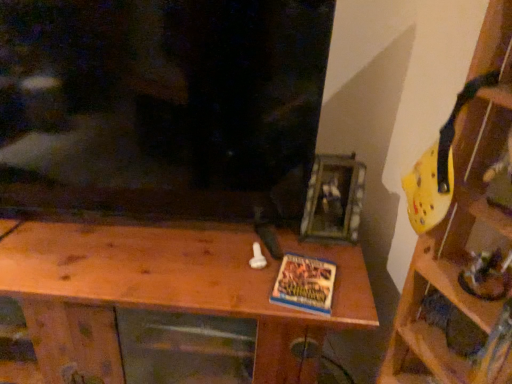
Question: Can you confirm if yellow plastic helmet at upper right, arranged as the second shelf when viewed from the left, is positioned to the right of blue matte book at center?

Choices:
 (A) yes
 (B) no

Answer: (A)

Question: Is yellow plastic helmet at upper right, the first shelf from the right, bigger than blue matte book at center?

Choices:
 (A) no
 (B) yes

Answer: (B)

Question: Can you confirm if yellow plastic helmet at upper right, arranged as the second shelf when viewed from the left, is taller than blue matte book at center?

Choices:
 (A) no
 (B) yes

Answer: (B)

Question: Is blue matte book at center at the back of yellow plastic helmet at upper right, arranged as the second shelf when viewed from the left?

Choices:
 (A) yes
 (B) no

Answer: (B)

Question: From the image's perspective, is yellow plastic helmet at upper right, arranged as the second shelf when viewed from the left, located beneath blue matte book at center?

Choices:
 (A) no
 (B) yes

Answer: (A)

Question: Considering the positions of point [423, 321] and point [89, 365], is point [423, 321] closer or farther from the camera than point [89, 365]?

Choices:
 (A) farther
 (B) closer

Answer: (B)

Question: In the image, is yellow plastic helmet at upper right, arranged as the second shelf when viewed from the left, positioned in front of or behind wooden at center, positioned as the 1th shelf in left-to-right order?

Choices:
 (A) behind
 (B) front

Answer: (B)

Question: In terms of width, does yellow plastic helmet at upper right, arranged as the second shelf when viewed from the left, look wider or thinner when compared to wooden at center, which is the second shelf in right-to-left order?

Choices:
 (A) thin
 (B) wide

Answer: (A)

Question: Considering the positions of yellow plastic helmet at upper right, arranged as the second shelf when viewed from the left, and wooden at center, positioned as the 1th shelf in left-to-right order, in the image, is yellow plastic helmet at upper right, arranged as the second shelf when viewed from the left, bigger or smaller than wooden at center, positioned as the 1th shelf in left-to-right order,?

Choices:
 (A) big
 (B) small

Answer: (B)

Question: Considering the relative positions of yellow plastic helmet at upper right, arranged as the second shelf when viewed from the left, and blue matte book at center in the image provided, is yellow plastic helmet at upper right, arranged as the second shelf when viewed from the left, to the left or to the right of blue matte book at center?

Choices:
 (A) right
 (B) left

Answer: (A)

Question: Choose the correct answer: Is yellow plastic helmet at upper right, arranged as the second shelf when viewed from the left, inside blue matte book at center or outside it?

Choices:
 (A) outside
 (B) inside

Answer: (A)

Question: From a real-world perspective, is yellow plastic helmet at upper right, the first shelf from the right, positioned above or below blue matte book at center?

Choices:
 (A) above
 (B) below

Answer: (A)

Question: In terms of width, does yellow plastic helmet at upper right, arranged as the second shelf when viewed from the left, look wider or thinner when compared to blue matte book at center?

Choices:
 (A) wide
 (B) thin

Answer: (A)

Question: Considering their positions, is blue matte book at center located in front of or behind yellow plastic helmet at upper right, arranged as the second shelf when viewed from the left?

Choices:
 (A) front
 (B) behind

Answer: (B)

Question: Which is correct: blue matte book at center is inside yellow plastic helmet at upper right, arranged as the second shelf when viewed from the left, or outside of it?

Choices:
 (A) inside
 (B) outside

Answer: (B)